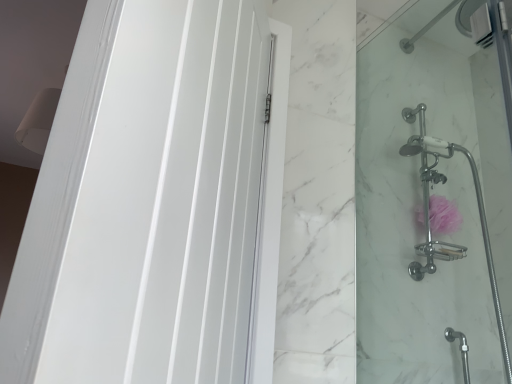
Question: Is clear glass shower door at right bigger or smaller than white glossy door at left?

Choices:
 (A) big
 (B) small

Answer: (A)

Question: From the image's perspective, relative to white glossy door at left, is clear glass shower door at right above or below?

Choices:
 (A) below
 (B) above

Answer: (A)

Question: Based on their relative distances, which object is farther from the pink fabric sponge at right?

Choices:
 (A) clear glass shower door at right
 (B) white glossy door at left

Answer: (B)

Question: Estimate the real-world distances between objects in this image. Which object is closer to the pink fabric sponge at right?

Choices:
 (A) white glossy door at left
 (B) clear glass shower door at right

Answer: (B)